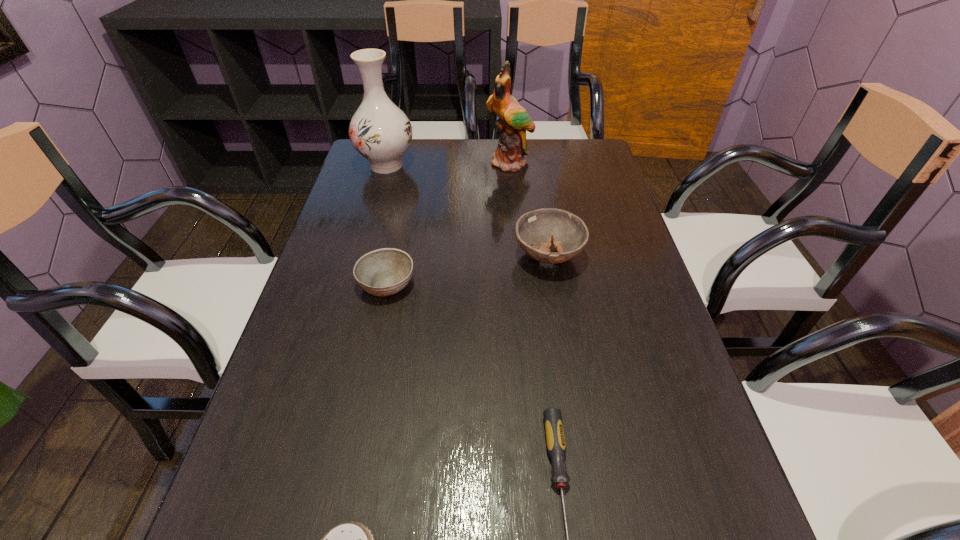
The height and width of the screenshot is (540, 960). Identify the location of vase located at the far edge. (380, 131).

This screenshot has height=540, width=960. Find the location of `parrot that is positioned at the far edge`. parrot that is positioned at the far edge is located at coordinates (514, 121).

Find the location of a particular element. vase situated at the left edge is located at coordinates tap(380, 131).

Identify the location of bowl located at the left edge. (383, 272).

You are a GUI agent. You are given a task and a screenshot of the screen. Output one action in this format:
    pyautogui.click(x=<x>, y=<y>)
    Task: Click on the object at the right edge
    The image size is (960, 540).
    Given the screenshot: What is the action you would take?
    pyautogui.click(x=535, y=230)

Find the location of a particular element. object present at the far left corner is located at coordinates (380, 131).

Locate an element on the screen. The height and width of the screenshot is (540, 960). blank space at the far edge of the desktop is located at coordinates (424, 148).

The image size is (960, 540). Find the location of `vacant space at the left edge of the desktop`. vacant space at the left edge of the desktop is located at coordinates coord(351,295).

At what (x,y) coordinates should I click in order to perform the action: click on vacant space at the right edge. Please return your answer as a coordinate pair (x, y). Image resolution: width=960 pixels, height=540 pixels. Looking at the image, I should click on (607, 236).

In the image, there is a desktop. At what (x,y) coordinates should I click in order to perform the action: click on free space at the far left corner. Please return your answer as a coordinate pair (x, y). This screenshot has height=540, width=960. Looking at the image, I should click on (355, 166).